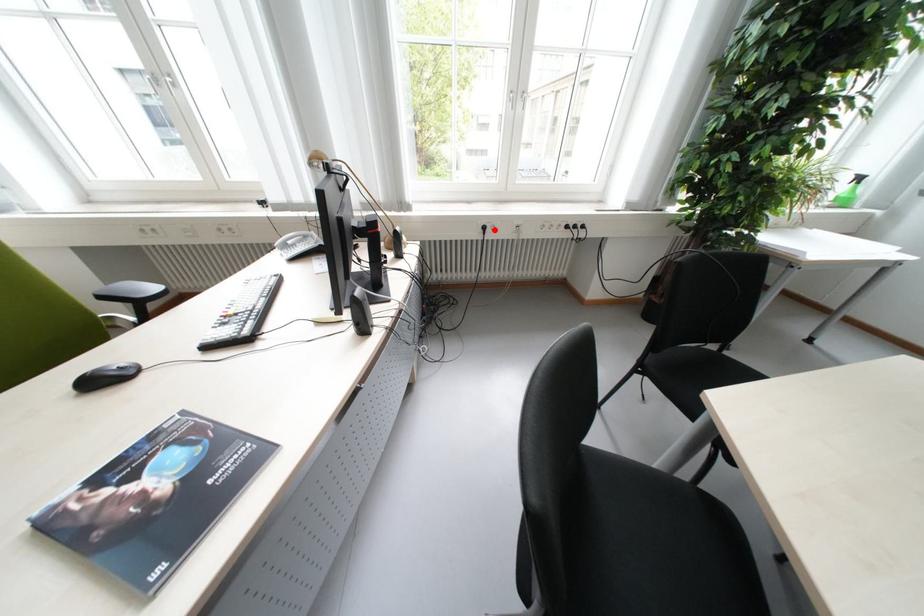
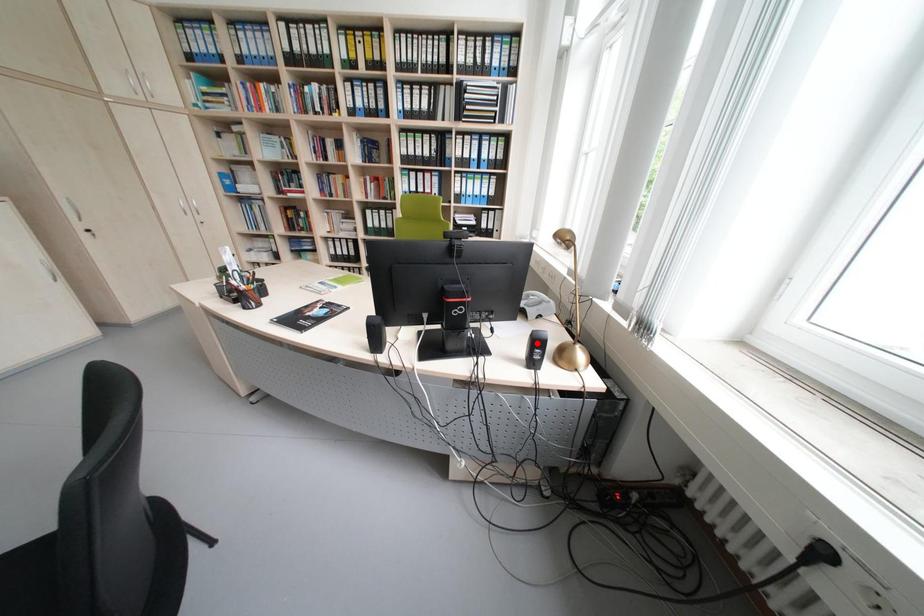
I am providing you with two images of the same scene from different viewpoints. A red point is marked on the first image and another point is marked on the second image. Do the highlighted points in image1 and image2 indicate the same real-world spot?

No